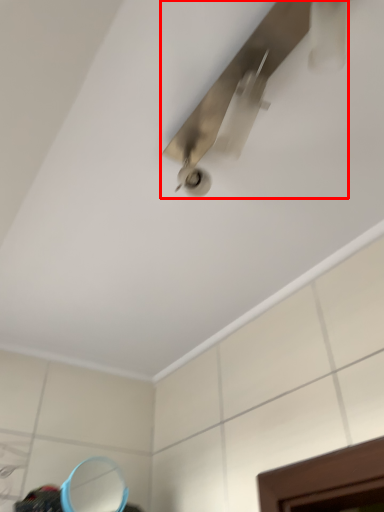
Question: From the image, what is the correct spatial relationship of ceiling fan (annotated by the red box) in relation to mirror?

Choices:
 (A) right
 (B) left

Answer: (A)